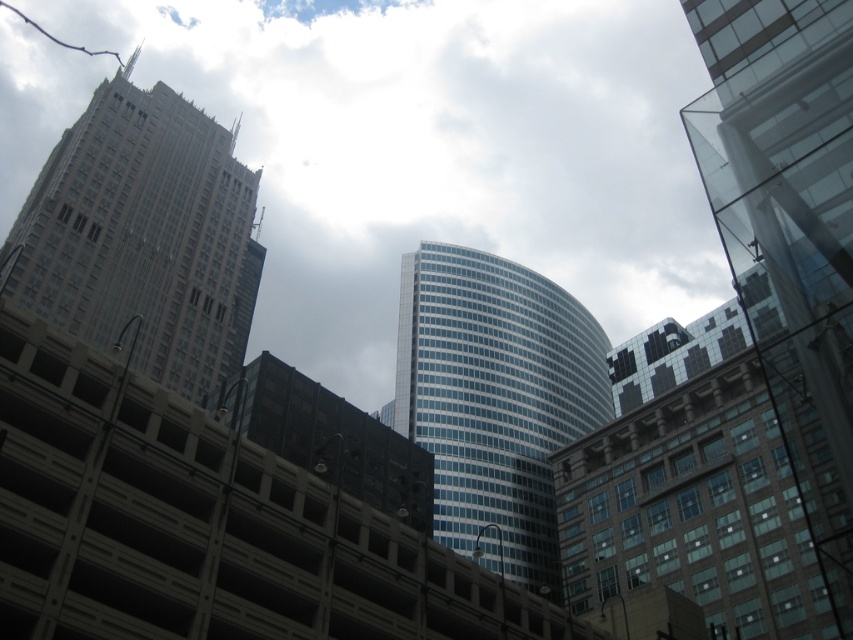
Who is higher up, gray stone skyscraper at left or glassy blue skyscraper at center?

gray stone skyscraper at left is above.

Does gray stone skyscraper at left have a smaller size compared to glassy blue skyscraper at center?

Indeed, gray stone skyscraper at left has a smaller size compared to glassy blue skyscraper at center.

Who is more distant from viewer, (144, 193) or (463, 440)?

Positioned behind is point (463, 440).

Locate an element on the screen. This screenshot has height=640, width=853. gray stone skyscraper at left is located at coordinates (144, 236).

Does transparent glass building at upper center have a greater height compared to gray stone skyscraper at left?

Indeed, transparent glass building at upper center has a greater height compared to gray stone skyscraper at left.

Is transparent glass building at upper center positioned before gray stone skyscraper at left?

No, it is not.

In order to click on transparent glass building at upper center in this screenshot , I will do `click(438, 150)`.

Locate an element on the screen. Image resolution: width=853 pixels, height=640 pixels. transparent glass building at upper center is located at coordinates (438, 150).

Who is lower down, transparent glass building at upper center or glassy blue skyscraper at center?

glassy blue skyscraper at center

Is transparent glass building at upper center positioned behind glassy blue skyscraper at center?

Yes.

Who is more forward, (x=257, y=339) or (x=555, y=528)?

Positioned in front is point (x=555, y=528).

Locate an element on the screen. The image size is (853, 640). transparent glass building at upper center is located at coordinates (438, 150).